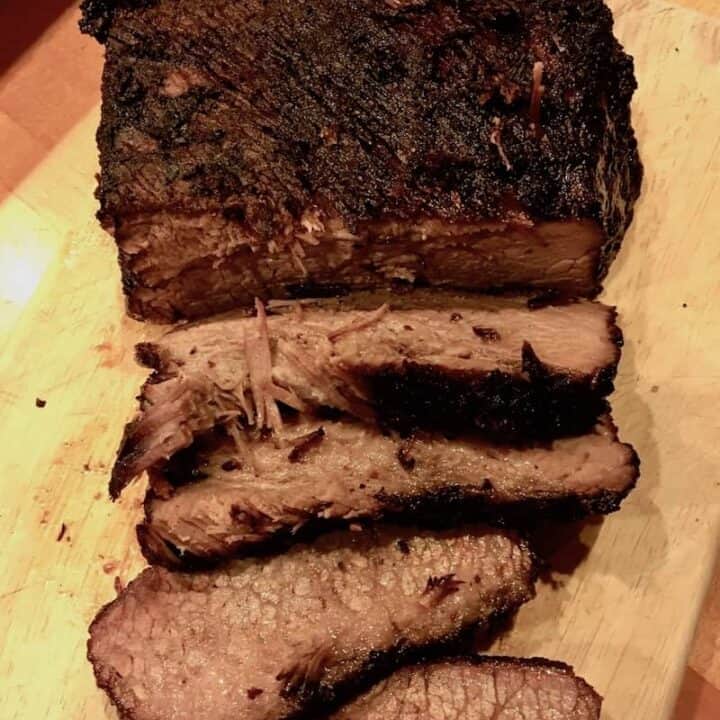
Where is `counter`? The height and width of the screenshot is (720, 720). counter is located at coordinates (706, 696).